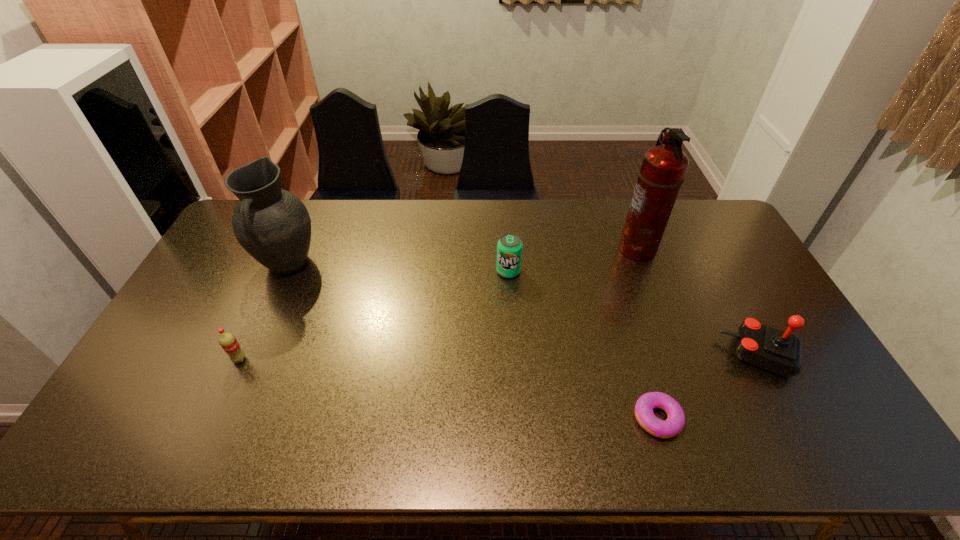
The width and height of the screenshot is (960, 540). I want to click on object that is at the right edge, so click(780, 352).

In the image, there is a desktop. Where is `vacant space at the far edge`? This screenshot has width=960, height=540. vacant space at the far edge is located at coordinates (339, 218).

In the image, there is a desktop. Find the location of `free space at the near edge`. free space at the near edge is located at coordinates (472, 447).

Image resolution: width=960 pixels, height=540 pixels. I want to click on vacant area at the left edge, so click(x=185, y=359).

This screenshot has width=960, height=540. In the image, there is a desktop. Find the location of `vacant space at the right edge`. vacant space at the right edge is located at coordinates (739, 263).

You are a GUI agent. You are given a task and a screenshot of the screen. Output one action in this format:
    pyautogui.click(x=<x>, y=<y>)
    Task: Click on the vacant space at the near left corner of the desktop
    This screenshot has height=540, width=960.
    Given the screenshot: What is the action you would take?
    pyautogui.click(x=158, y=426)

Identify the location of vacant space in between the fire extinguisher and the nearer soda. (439, 304).

The image size is (960, 540). I want to click on free space between the third object from left to right and the nearest object, so click(x=583, y=345).

Where is `free area in between the fourth object from right to left and the pitcher`? free area in between the fourth object from right to left and the pitcher is located at coordinates (397, 268).

Locate an element on the screen. This screenshot has width=960, height=540. vacant space in between the tallest object and the fifth shortest object is located at coordinates (463, 256).